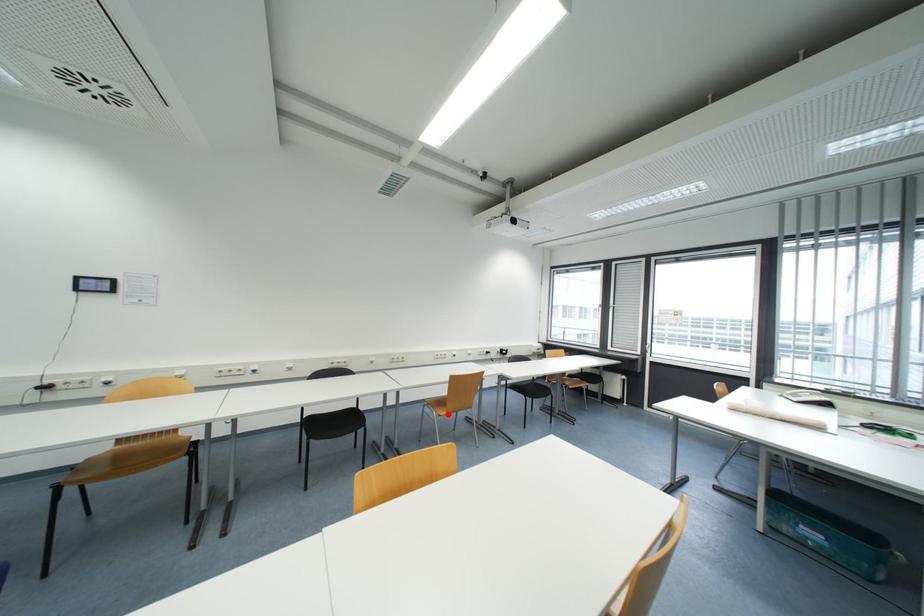
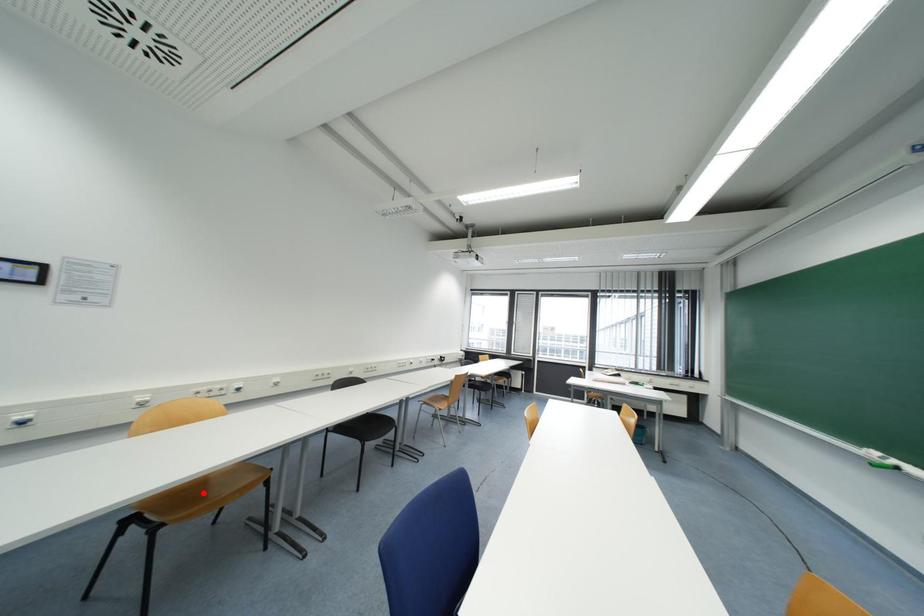
I am providing you with two images of the same scene from different viewpoints. A red point is marked on the first image and another point is marked on the second image. Do the highlighted points in image1 and image2 indicate the same real-world spot?

No